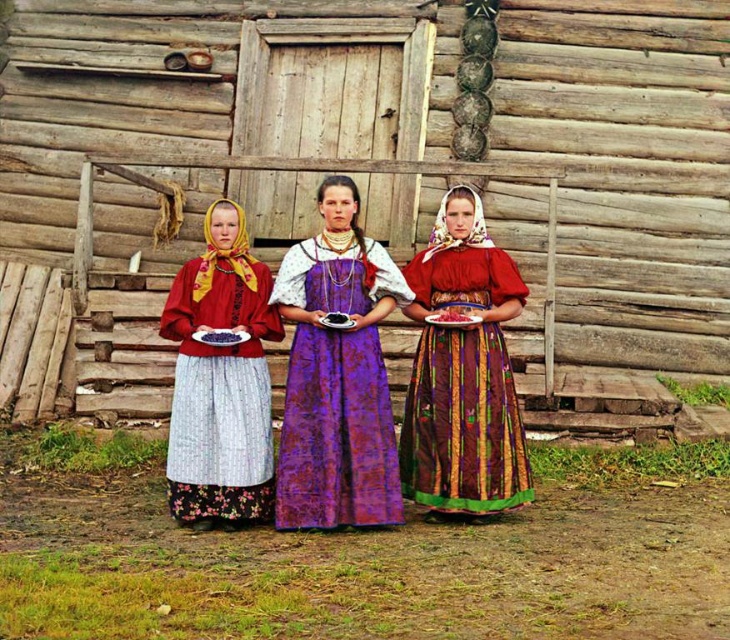
Is point (326, 372) positioned in front of point (237, 433)?

Yes, point (326, 372) is in front of point (237, 433).

Consider the image. Does purple brocade dress at center appear on the left side of matte red blouse at center?

Incorrect, purple brocade dress at center is not on the left side of matte red blouse at center.

Identify the location of purple brocade dress at center. (337, 374).

I want to click on purple brocade dress at center, so 337,374.

Based on the photo, is matte red dress at center thinner than red glossy plate at center?

No.

Does matte red dress at center have a greater height compared to red glossy plate at center?

Indeed, matte red dress at center has a greater height compared to red glossy plate at center.

I want to click on matte red dress at center, so click(x=464, y=371).

Who is lower down, matte red blouse at center or red glossy plate at center?

matte red blouse at center

Can you confirm if matte red blouse at center is positioned below red glossy plate at center?

Correct, matte red blouse at center is located below red glossy plate at center.

At what (x,y) coordinates should I click in order to perform the action: click on matte red blouse at center. Please return your answer as a coordinate pair (x, y). Looking at the image, I should click on (220, 380).

Where is `matte red blouse at center`? This screenshot has width=730, height=640. matte red blouse at center is located at coordinates click(220, 380).